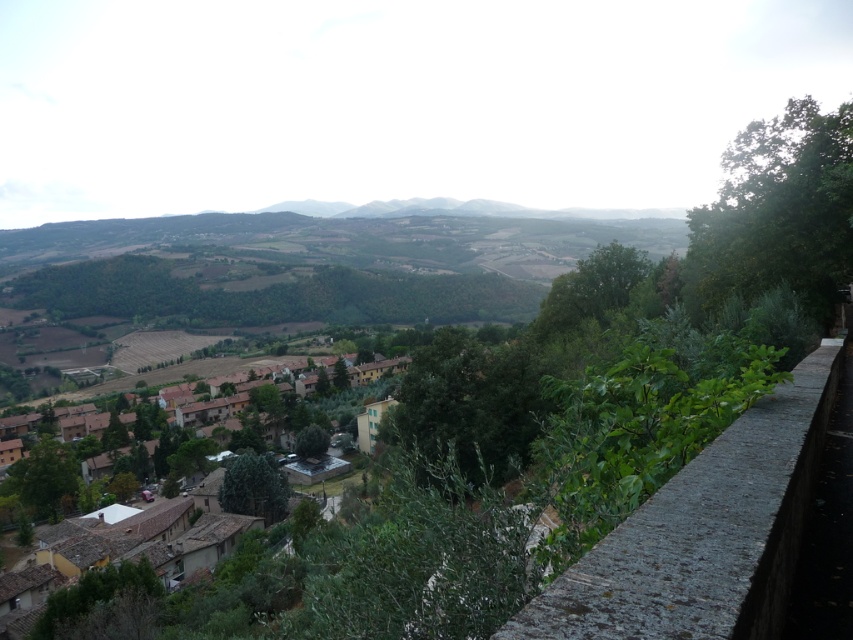
In the scene shown: You are standing at the center of the image and want to reach the gray stone ledge at right. Which direction should you move to get there?

To reach the gray stone ledge at right, you should move to the right since it is located at the right side of the image.

You are standing at the viewpoint looking at the rural landscape. You see the gray stone ledge at right and the brown tiled roofs at lower center. Which object is positioned to the right of the other?

The gray stone ledge at right is positioned to the right of the brown tiled roofs at lower center.